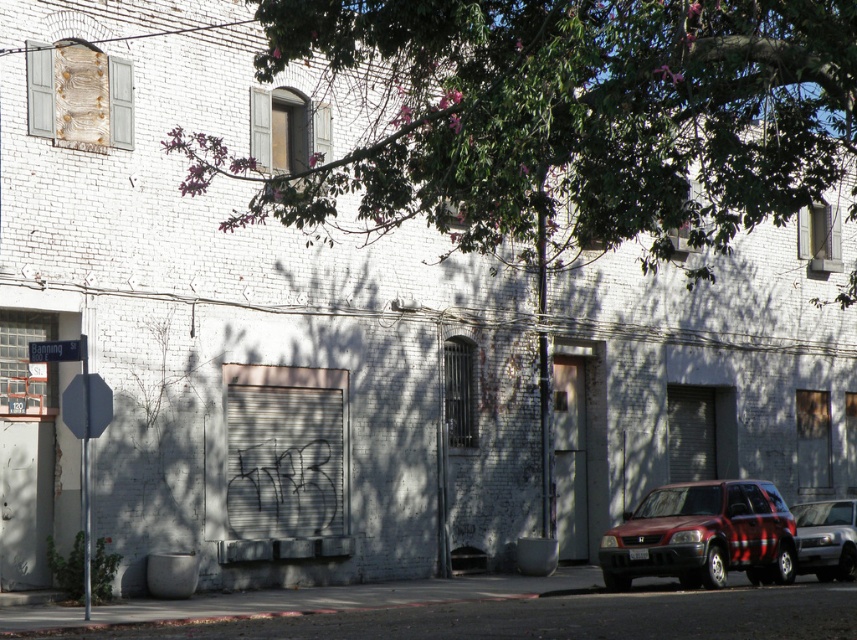
Which is more to the right, silver metallic suv at lower right or metallic blue street sign at left?

silver metallic suv at lower right is more to the right.

Is point (826, 528) positioned behind point (69, 346)?

That is True.

You are a GUI agent. You are given a task and a screenshot of the screen. Output one action in this format:
    pyautogui.click(x=<x>, y=<y>)
    Task: Click on the silver metallic suv at lower right
    The image size is (857, 640).
    Given the screenshot: What is the action you would take?
    pyautogui.click(x=826, y=538)

Describe the element at coordinates (576, 116) in the screenshot. This screenshot has width=857, height=640. I see `green leafy tree at upper center` at that location.

Does green leafy tree at upper center have a greater height compared to metallic blue street sign at left?

Yes.

Which is in front, point (810, 188) or point (48, 355)?

Positioned in front is point (810, 188).

The width and height of the screenshot is (857, 640). What are the coordinates of `green leafy tree at upper center` in the screenshot? It's located at (576, 116).

Can you confirm if matte red suv at lower right is positioned above silver metallic suv at lower right?

Yes.

Which is behind, point (734, 531) or point (852, 532)?

Positioned behind is point (852, 532).

Locate an element on the screen. matte red suv at lower right is located at coordinates (702, 536).